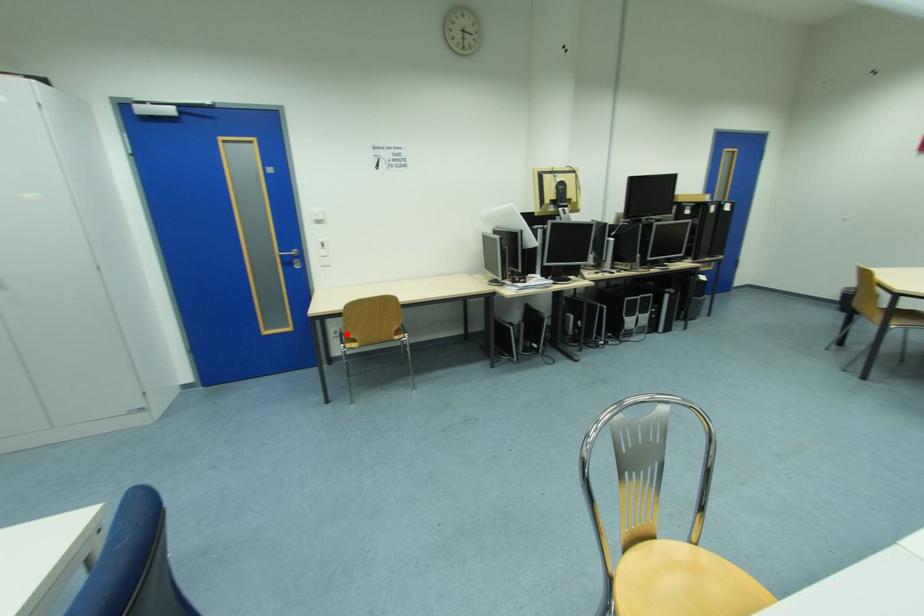
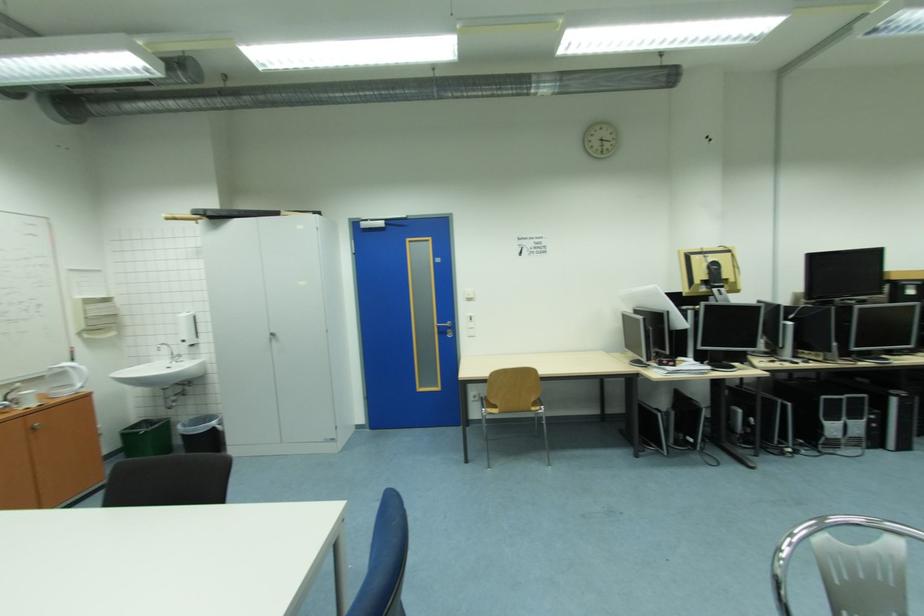
Question: I am providing you with two images of the same scene from different viewpoints. In image1, a red point is highlighted. Considering the same 3D point in image2, which of the following is correct?

Choices:
 (A) It is closer
 (B) It is farther

Answer: (B)